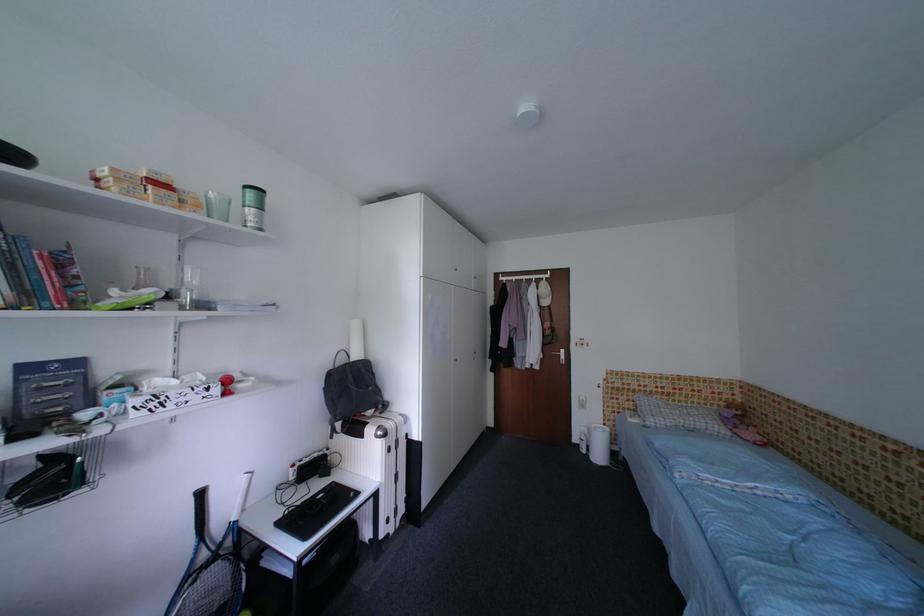
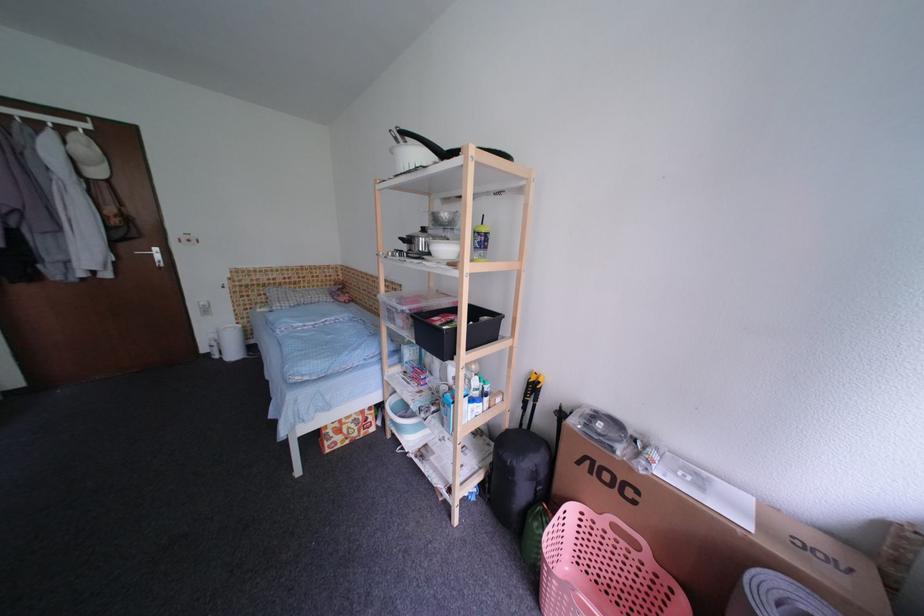
Find the pixel in the second image that matches point 591,432 in the first image.

(222, 338)